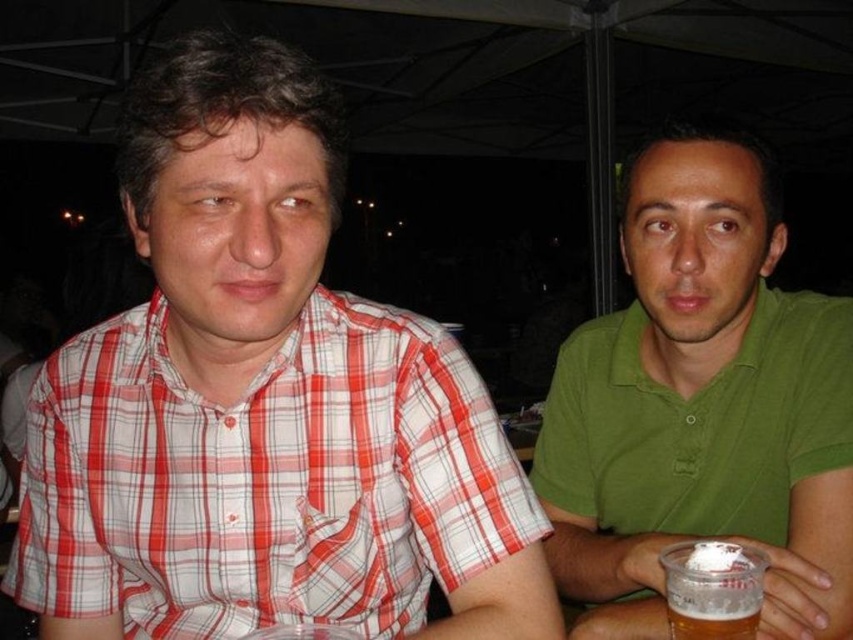
You are a photographer trying to capture a group photo of the red plaid shirt at left and the green matte shirt at center. Since you want to ensure both subjects are clearly visible, which subject should you adjust the camera focus on first considering their sizes?

The red plaid shirt at left is wider than the green matte shirt at center, so you should focus on the red plaid shirt at left first to ensure its details are captured clearly before adjusting for the smaller subject.

Looking at this image, you are standing in front of the two individuals under the canopy. The red plaid shirt at left is located at point A and the green polo shirt at right is at point B. Which point is closer to the distant light sources?

The red plaid shirt at left is located at point A, which is closer to the distant light sources compared to point B.